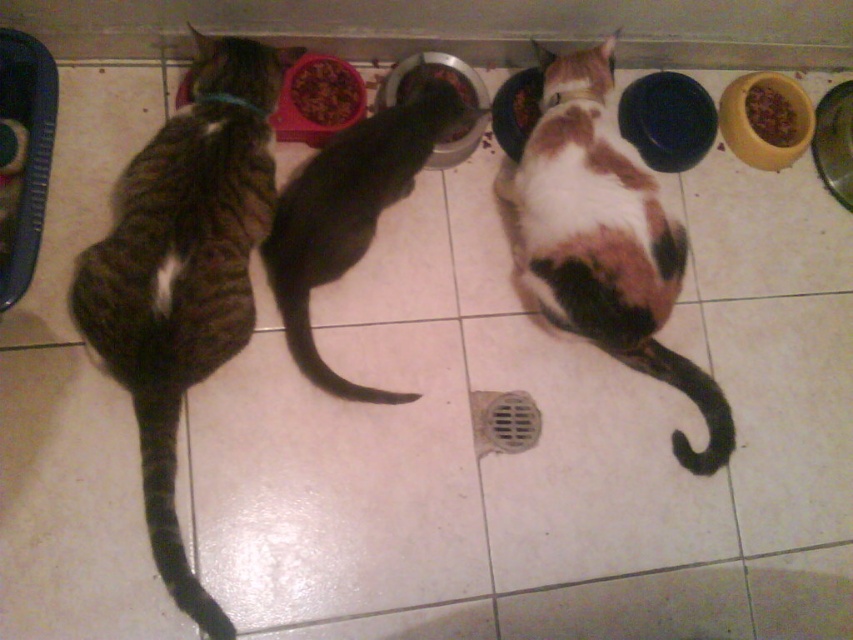
Consider the image. Is black glossy cat at center above brown matte food at upper right?

No, black glossy cat at center is not above brown matte food at upper right.

Consider the image. Is black glossy cat at center further to camera compared to brown matte food at upper right?

No, black glossy cat at center is closer to the viewer.

What do you see at coordinates (350, 212) in the screenshot? I see `black glossy cat at center` at bounding box center [350, 212].

Where is `black glossy cat at center`? black glossy cat at center is located at coordinates (350, 212).

Does calico fur cat at center have a lesser width compared to black glossy cat at center?

No, calico fur cat at center is not thinner than black glossy cat at center.

What do you see at coordinates (604, 237) in the screenshot?
I see `calico fur cat at center` at bounding box center [604, 237].

Image resolution: width=853 pixels, height=640 pixels. Find the location of `calico fur cat at center`. calico fur cat at center is located at coordinates (604, 237).

Is brown matte food at upper right further to the viewer compared to brown matte food at center?

Yes, brown matte food at upper right is further from the viewer.

From the picture: Does brown matte food at upper right appear on the right side of brown matte food at center?

Correct, you'll find brown matte food at upper right to the right of brown matte food at center.

Identify the location of brown matte food at upper right. (770, 115).